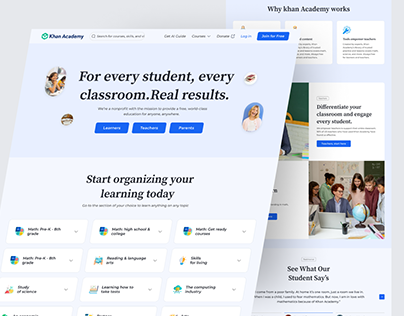
The height and width of the screenshot is (316, 404). What are the coordinates of `table` in the screenshot? It's located at (332, 233).